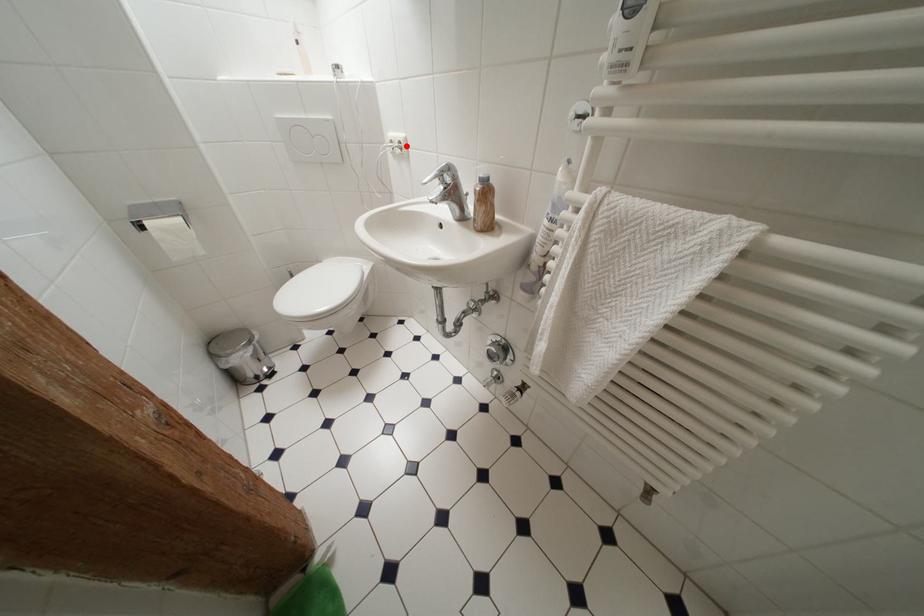
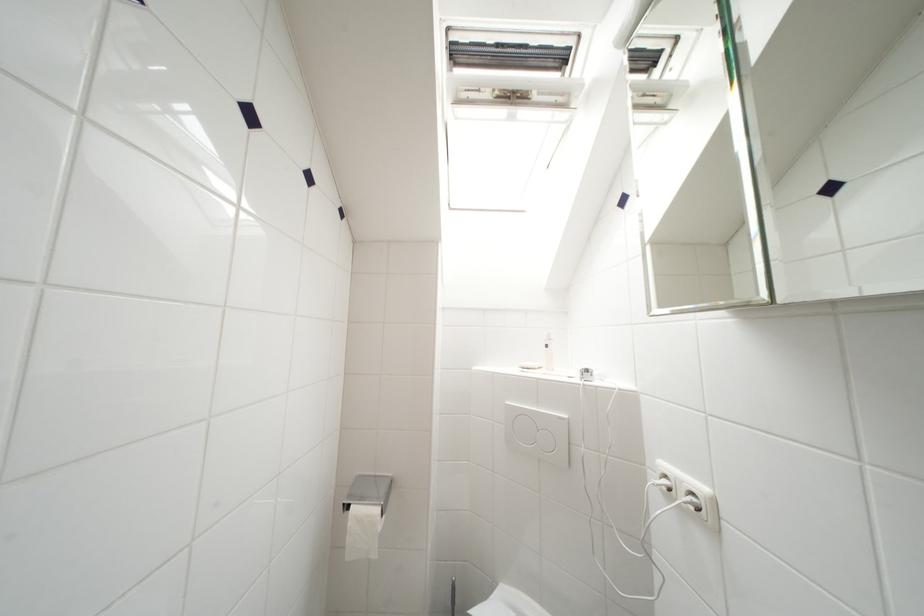
Question: I am providing you with two images of the same scene from different viewpoints. A red point is marked on the first image. Is the red point's position out of view in image 2?

Choices:
 (A) Yes
 (B) No

Answer: (B)